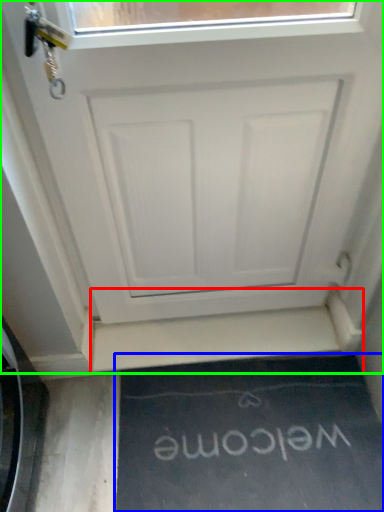
Question: Estimate the real-world distances between objects in this image. Which object is farther from stairwell (highlighted by a red box), doormat (highlighted by a blue box) or door (highlighted by a green box)?

Choices:
 (A) doormat
 (B) door

Answer: (B)